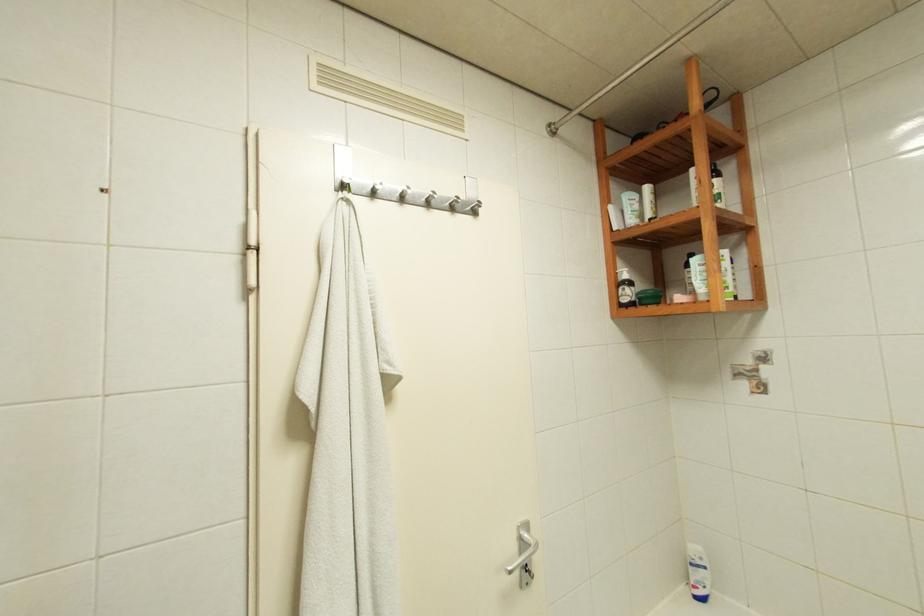
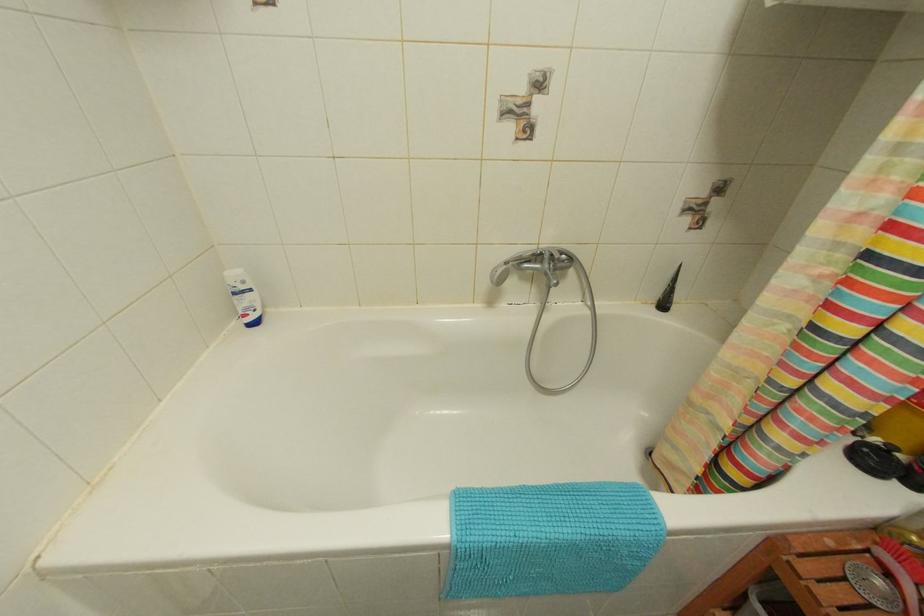
The images are taken continuously from a first-person perspective. In which direction is your viewpoint rotating?

The camera rotated toward right-down.